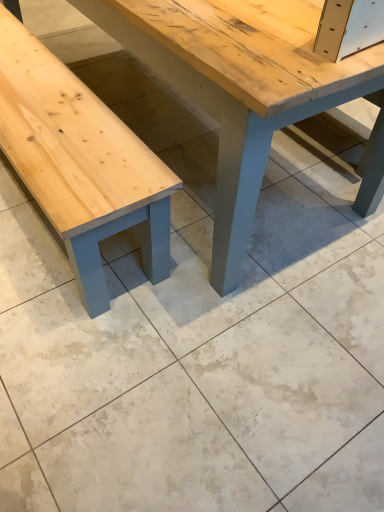
The height and width of the screenshot is (512, 384). What do you see at coordinates (238, 86) in the screenshot?
I see `natural wood table at center` at bounding box center [238, 86].

In order to face natural wood table at center, should I rotate leftwards or rightwards?

It's best to rotate left around 4.051 degrees.

Image resolution: width=384 pixels, height=512 pixels. What are the coordinates of `natural wood table at center` in the screenshot? It's located at (238, 86).

The height and width of the screenshot is (512, 384). I want to click on natural wood table at center, so click(x=238, y=86).